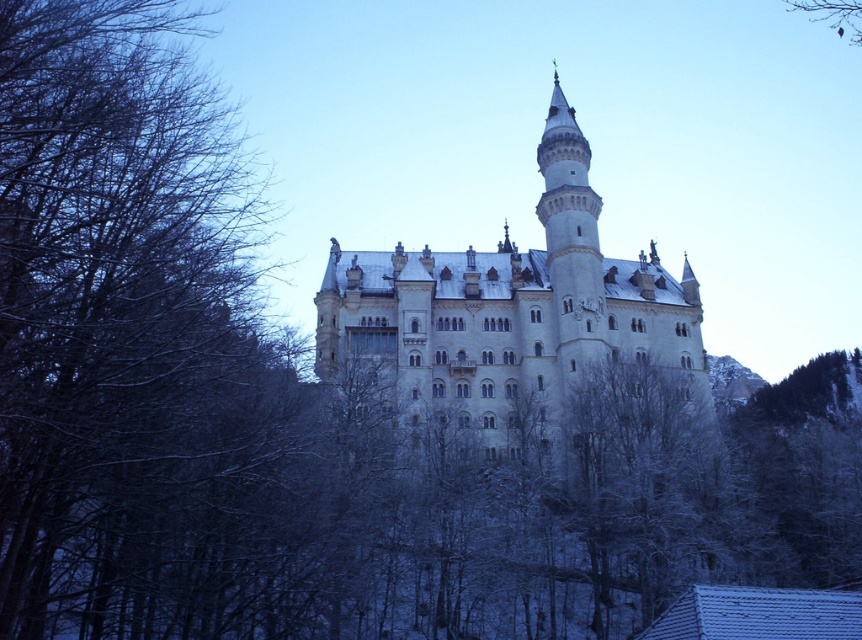
Question: Does white stone castle at center appear under brown textured branch at upper right?

Choices:
 (A) yes
 (B) no

Answer: (A)

Question: Among these points, which one is farthest from the camera?

Choices:
 (A) (823, 16)
 (B) (476, 342)

Answer: (A)

Question: Does white stone castle at center appear under brown textured branch at upper right?

Choices:
 (A) yes
 (B) no

Answer: (A)

Question: Considering the relative positions of white stone castle at center and brown textured branch at upper right in the image provided, where is white stone castle at center located with respect to brown textured branch at upper right?

Choices:
 (A) above
 (B) below

Answer: (B)